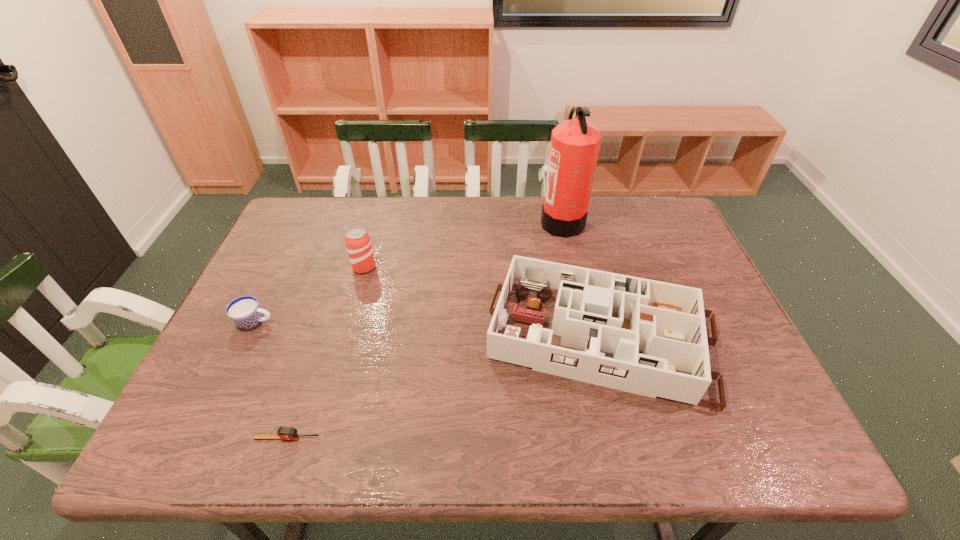
The width and height of the screenshot is (960, 540). In order to click on free space between the third shortest object and the cup in this screenshot , I will do `click(428, 330)`.

At what (x,y) coordinates should I click in order to perform the action: click on empty location between the shortest object and the second shortest object. Please return your answer as a coordinate pair (x, y). The image size is (960, 540). Looking at the image, I should click on (271, 380).

This screenshot has width=960, height=540. Find the location of `empty space that is in between the fire extinguisher and the shortest object`. empty space that is in between the fire extinguisher and the shortest object is located at coordinates (424, 329).

Identify the location of free space between the tape measure and the dollhouse. The height and width of the screenshot is (540, 960). (444, 388).

At what (x,y) coordinates should I click in order to perform the action: click on free space between the fourth shortest object and the tape measure. Please return your answer as a coordinate pair (x, y). Looking at the image, I should click on (325, 353).

You are a GUI agent. You are given a task and a screenshot of the screen. Output one action in this format:
    pyautogui.click(x=<x>, y=<y>)
    Task: Click on the vacant space that is in between the fourth tallest object and the tallest object
    
    Given the screenshot: What is the action you would take?
    pyautogui.click(x=408, y=272)

This screenshot has width=960, height=540. Find the location of `free space between the second farthest object and the shortest object`. free space between the second farthest object and the shortest object is located at coordinates (325, 353).

Point out which object is positioned as the fourth nearest to the beer can. Please provide its 2D coordinates. Your answer should be formatted as a tuple, i.e. [(x, y)], where the tuple contains the x and y coordinates of a point satisfying the conditions above.

[(575, 143)]

Where is `object that is the closest to the cup`? The width and height of the screenshot is (960, 540). object that is the closest to the cup is located at coordinates (358, 244).

Where is `free location that satisfies the following two spatial constraints: 1. on the back side of the nearest object; 2. on the left side of the dollhouse`? free location that satisfies the following two spatial constraints: 1. on the back side of the nearest object; 2. on the left side of the dollhouse is located at coordinates click(x=320, y=339).